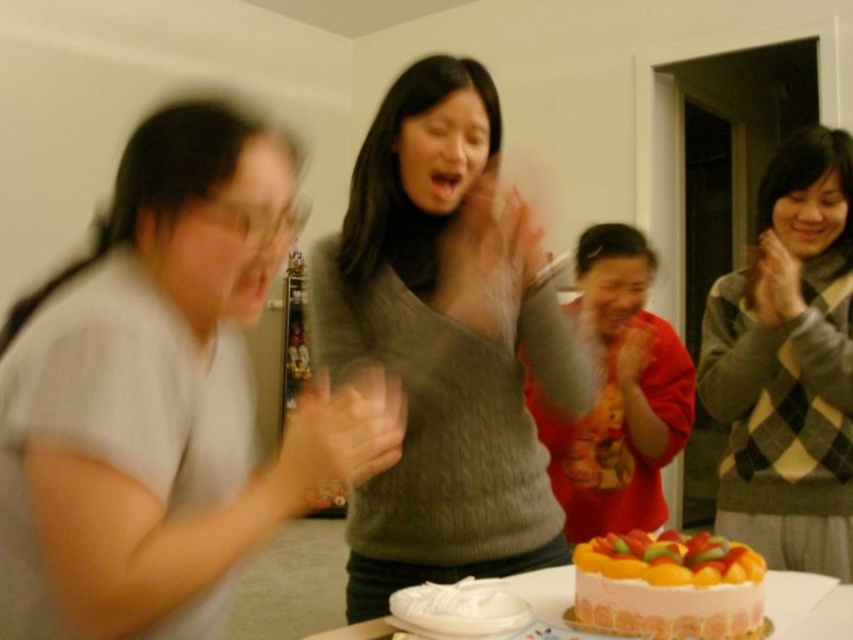
Question: Among these points, which one is farthest from the camera?

Choices:
 (A) (663, 577)
 (B) (688, 577)
 (C) (784, 278)
 (D) (466, 560)

Answer: (C)

Question: Among these points, which one is nearest to the camera?

Choices:
 (A) (633, 557)
 (B) (769, 576)

Answer: (A)

Question: Does knitted gray sweater at center have a greater width compared to smooth orange cake at lower center?

Choices:
 (A) no
 (B) yes

Answer: (B)

Question: Observing the image, what is the correct spatial positioning of smooth orange cake at lower center in reference to smooth gray sweater at center?

Choices:
 (A) below
 (B) above

Answer: (A)

Question: From the image, what is the correct spatial relationship of knitted gray sweater at center in relation to smooth orange cake at lower center?

Choices:
 (A) below
 (B) above

Answer: (B)

Question: Which point is farther from the camera taking this photo?

Choices:
 (A) (772, 250)
 (B) (589, 563)
 (C) (537, 556)
 (D) (793, 573)

Answer: (A)